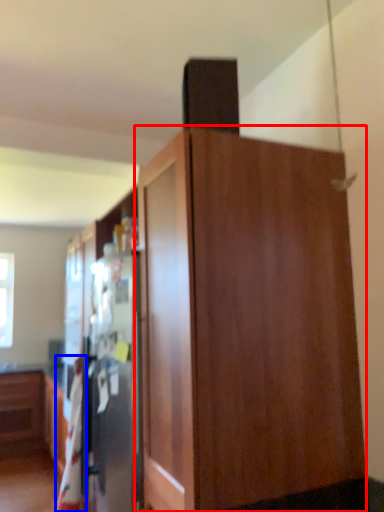
Question: Which object is closer to the camera taking this photo, cupboard (highlighted by a red box) or blanket (highlighted by a blue box)?

Choices:
 (A) cupboard
 (B) blanket

Answer: (A)